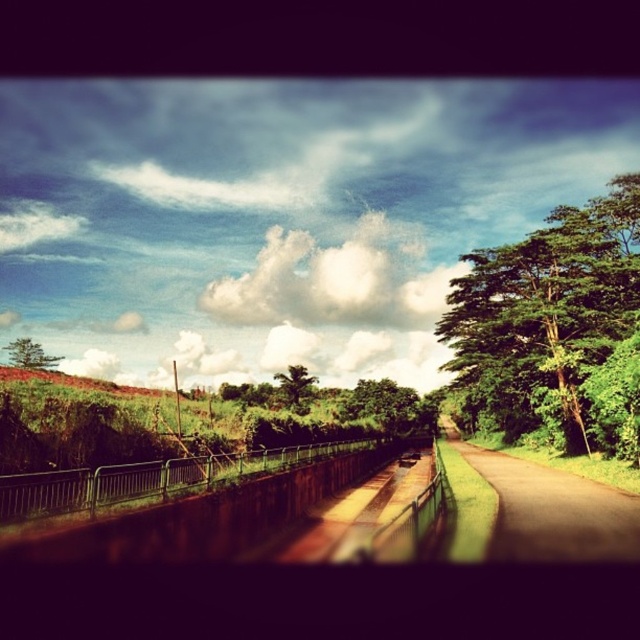
Question: Can you confirm if green leafy tree at right is smaller than green leafy tree at left?

Choices:
 (A) yes
 (B) no

Answer: (B)

Question: Which object is closer to the camera taking this photo?

Choices:
 (A) brown asphalt road at center
 (B) white fluffy cloud at upper center

Answer: (A)

Question: Which is nearer to the green leafy tree at center?

Choices:
 (A) brown asphalt road at center
 (B) white fluffy cloud at upper center
 (C) green leafy tree at left

Answer: (B)

Question: Where is white fluffy cloud at upper center located in relation to green leafy tree at left in the image?

Choices:
 (A) right
 (B) left

Answer: (A)

Question: Is brown asphalt road at center bigger than green leafy tree at center?

Choices:
 (A) no
 (B) yes

Answer: (B)

Question: Which point appears farthest from the camera in this image?

Choices:
 (A) (600, 541)
 (B) (294, 406)
 (C) (371, 314)

Answer: (C)